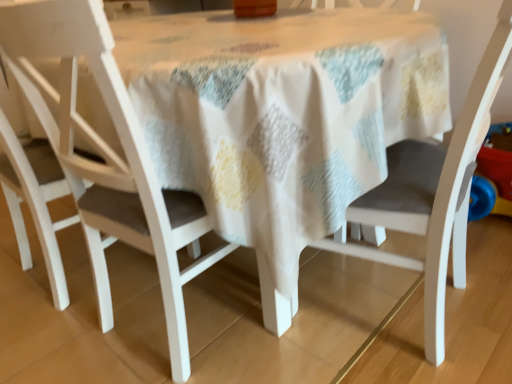
At what (x,y) coordinates should I click in order to perform the action: click on white matte chair at left, positioned as the first chair in left-to-right order. Please return your answer as a coordinate pair (x, y). The width and height of the screenshot is (512, 384). Looking at the image, I should click on (34, 198).

Where is `white matte chair at center, the first chair in the right-to-left sequence`? Image resolution: width=512 pixels, height=384 pixels. white matte chair at center, the first chair in the right-to-left sequence is located at coordinates (434, 191).

What is the approximate width of white matte chair at center, the first chair in the right-to-left sequence?

22.46 inches.

Where is `white matte chair at left, arranged as the third chair when viewed from the right`? The width and height of the screenshot is (512, 384). white matte chair at left, arranged as the third chair when viewed from the right is located at coordinates (34, 198).

Is white matte chair at left, arranged as the third chair when viewed from the right, facing towards matte white chair at center, the 2th chair in the right-to-left sequence?

No, white matte chair at left, arranged as the third chair when viewed from the right, is not facing towards matte white chair at center, the 2th chair in the right-to-left sequence.

Is white matte chair at left, positioned as the first chair in left-to-right order, positioned far away from matte white chair at center, the second chair in the left-to-right sequence?

Actually, white matte chair at left, positioned as the first chair in left-to-right order, and matte white chair at center, the second chair in the left-to-right sequence, are a little close together.

Does point (42, 188) appear closer or farther from the camera than point (121, 224)?

Point (42, 188).

Looking at this image, between white matte chair at center, the first chair in the right-to-left sequence, and white matte chair at left, arranged as the third chair when viewed from the right, which one has smaller width?

white matte chair at left, arranged as the third chair when viewed from the right.

Which object is further away from the camera, white matte chair at center, the first chair in the right-to-left sequence, or white matte chair at left, positioned as the first chair in left-to-right order?

Positioned behind is white matte chair at left, positioned as the first chair in left-to-right order.

Can you confirm if white matte chair at center, which is the 3th chair from left to right, is positioned to the left of white matte chair at left, positioned as the first chair in left-to-right order?

Incorrect, white matte chair at center, which is the 3th chair from left to right, is not on the left side of white matte chair at left, positioned as the first chair in left-to-right order.

Is white matte chair at center, the first chair in the right-to-left sequence, located outside white matte chair at left, arranged as the third chair when viewed from the right?

Yes, white matte chair at center, the first chair in the right-to-left sequence, is not within white matte chair at left, arranged as the third chair when viewed from the right.

Is matte white chair at center, the second chair in the left-to-right sequence, closer to the viewer compared to white matte chair at left, positioned as the first chair in left-to-right order?

Yes.

Between matte white chair at center, the second chair in the left-to-right sequence, and white matte chair at left, arranged as the third chair when viewed from the right, which one has smaller width?

white matte chair at left, arranged as the third chair when viewed from the right, is thinner.

How many degrees apart are the facing directions of matte white chair at center, the second chair in the left-to-right sequence, and white matte chair at left, arranged as the third chair when viewed from the right?

0.000478 degrees separate the facing orientations of matte white chair at center, the second chair in the left-to-right sequence, and white matte chair at left, arranged as the third chair when viewed from the right.

Which point is more forward, (14, 39) or (49, 146)?

Positioned in front is point (14, 39).

Can white matte chair at center, the first chair in the right-to-left sequence, be found inside white matte chair at left, arranged as the third chair when viewed from the right?

That's incorrect, white matte chair at center, the first chair in the right-to-left sequence, is not inside white matte chair at left, arranged as the third chair when viewed from the right.

Is white matte chair at left, arranged as the third chair when viewed from the right, facing away from white matte chair at center, which is the 3th chair from left to right?

white matte chair at left, arranged as the third chair when viewed from the right, does not have its back to white matte chair at center, which is the 3th chair from left to right.

In the scene shown: From a real-world perspective, is white matte chair at left, arranged as the third chair when viewed from the right, located higher than white matte chair at center, the first chair in the right-to-left sequence?

Yes, from a real-world perspective, white matte chair at left, arranged as the third chair when viewed from the right, is on top of white matte chair at center, the first chair in the right-to-left sequence.

Considering the relative sizes of white matte chair at left, arranged as the third chair when viewed from the right, and white matte chair at center, the first chair in the right-to-left sequence, in the image provided, is white matte chair at left, arranged as the third chair when viewed from the right, taller than white matte chair at center, the first chair in the right-to-left sequence,?

Correct, white matte chair at left, arranged as the third chair when viewed from the right, is much taller as white matte chair at center, the first chair in the right-to-left sequence.

Which of these two, matte white chair at center, the second chair in the left-to-right sequence, or white matte chair at center, which is the 3th chair from left to right, is smaller?

matte white chair at center, the second chair in the left-to-right sequence.

Looking at this image, from a real-world perspective, is matte white chair at center, the second chair in the left-to-right sequence, beneath white matte chair at center, the first chair in the right-to-left sequence?

No, from a real-world perspective, matte white chair at center, the second chair in the left-to-right sequence, is not below white matte chair at center, the first chair in the right-to-left sequence.

From the image's perspective, is matte white chair at center, the 2th chair in the right-to-left sequence, located above or below white matte chair at center, which is the 3th chair from left to right?

Clearly, from the image's perspective, matte white chair at center, the 2th chair in the right-to-left sequence, is below white matte chair at center, which is the 3th chair from left to right.

Considering the positions of point (108, 198) and point (461, 178), is point (108, 198) closer or farther from the camera than point (461, 178)?

Point (108, 198) is farther from the camera than point (461, 178).

In the scene shown: Is white matte chair at center, the first chair in the right-to-left sequence, not near matte white chair at center, the 2th chair in the right-to-left sequence?

No, white matte chair at center, the first chair in the right-to-left sequence, is not far away from matte white chair at center, the 2th chair in the right-to-left sequence.

Could matte white chair at center, the second chair in the left-to-right sequence, be considered to be inside white matte chair at center, the first chair in the right-to-left sequence?

Result: No.

From a real-world perspective, is white matte chair at center, the first chair in the right-to-left sequence, on matte white chair at center, the second chair in the left-to-right sequence?

Actually, white matte chair at center, the first chair in the right-to-left sequence, is physically below matte white chair at center, the second chair in the left-to-right sequence, in the real world.

From the image's perspective, does white matte chair at center, which is the 3th chair from left to right, appear higher than matte white chair at center, the second chair in the left-to-right sequence?

Yes, from the image's perspective, white matte chair at center, which is the 3th chair from left to right, is on top of matte white chair at center, the second chair in the left-to-right sequence.

Locate an element on the screen. The width and height of the screenshot is (512, 384). chair that is the 2nd object located above the matte white chair at center, the second chair in the left-to-right sequence (from the image's perspective) is located at coordinates (34, 198).

Starting from the white matte chair at center, the first chair in the right-to-left sequence, which chair is the 2nd one to the left? Please provide its 2D coordinates.

[(34, 198)]

Considering their positions, is white matte chair at center, the first chair in the right-to-left sequence, positioned closer to matte white chair at center, the second chair in the left-to-right sequence, than white matte chair at left, arranged as the third chair when viewed from the right?

The object closer to matte white chair at center, the second chair in the left-to-right sequence, is white matte chair at left, arranged as the third chair when viewed from the right.

Estimate the real-world distances between objects in this image. Which object is further from white matte chair at center, the first chair in the right-to-left sequence, white matte chair at left, positioned as the first chair in left-to-right order, or matte white chair at center, the second chair in the left-to-right sequence?

Among the two, white matte chair at left, positioned as the first chair in left-to-right order, is located further to white matte chair at center, the first chair in the right-to-left sequence.

Based on their spatial positions, is matte white chair at center, the second chair in the left-to-right sequence, or white matte chair at left, positioned as the first chair in left-to-right order, further from white matte chair at center, which is the 3th chair from left to right?

The object further to white matte chair at center, which is the 3th chair from left to right, is white matte chair at left, positioned as the first chair in left-to-right order.

When comparing their distances from white matte chair at left, arranged as the third chair when viewed from the right, does white matte chair at center, which is the 3th chair from left to right, or matte white chair at center, the second chair in the left-to-right sequence, seem further?

white matte chair at center, which is the 3th chair from left to right.

Estimate the real-world distances between objects in this image. Which object is further from matte white chair at center, the second chair in the left-to-right sequence, white matte chair at left, positioned as the first chair in left-to-right order, or white matte chair at center, the first chair in the right-to-left sequence?

white matte chair at center, the first chair in the right-to-left sequence.

Considering their positions, is matte white chair at center, the 2th chair in the right-to-left sequence, positioned further to white matte chair at left, positioned as the first chair in left-to-right order, than white matte chair at center, the first chair in the right-to-left sequence?

white matte chair at center, the first chair in the right-to-left sequence, lies further to white matte chair at left, positioned as the first chair in left-to-right order, than the other object.

Find the location of `chair between white matte chair at left, arranged as the third chair when viewed from the right, and white matte chair at center, the first chair in the right-to-left sequence`. chair between white matte chair at left, arranged as the third chair when viewed from the right, and white matte chair at center, the first chair in the right-to-left sequence is located at coordinates (108, 158).